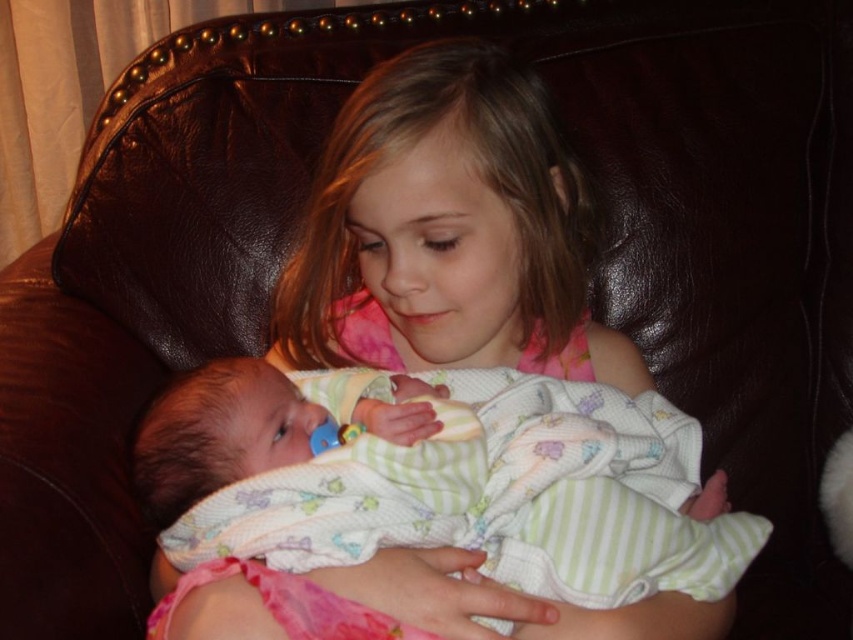
Can you confirm if pink fabric dress at center is positioned below soft green fabric baby at center?

No.

Between pink fabric dress at center and soft green fabric baby at center, which one appears on the left side from the viewer's perspective?

From the viewer's perspective, pink fabric dress at center appears more on the left side.

Does point (537, 435) come farther from viewer compared to point (363, 602)?

Yes, point (537, 435) is behind point (363, 602).

The image size is (853, 640). I want to click on pink fabric dress at center, so click(444, 394).